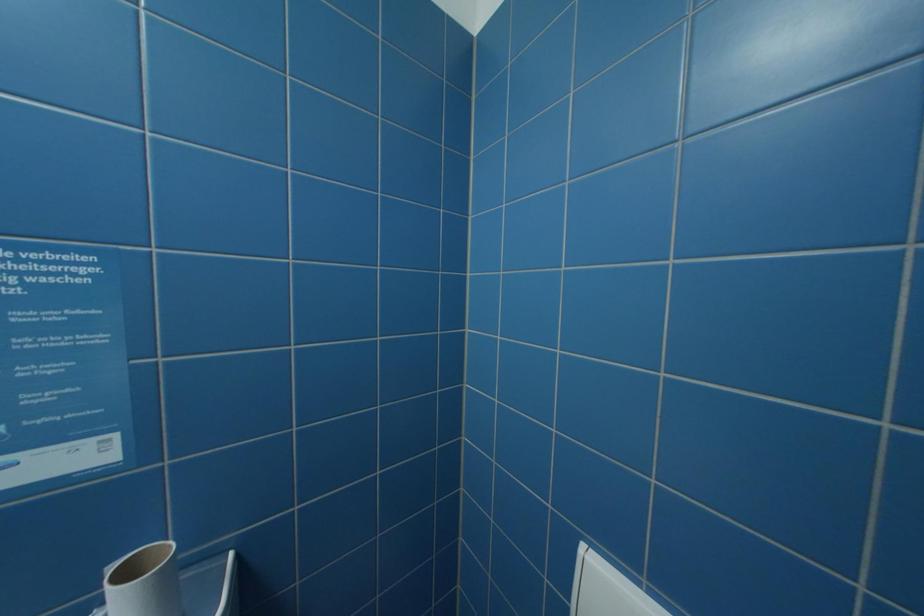
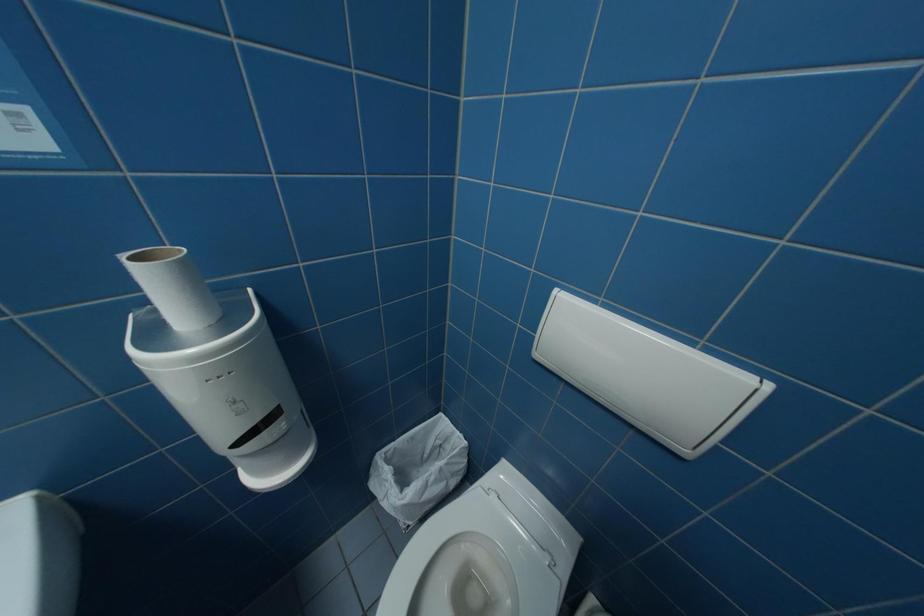
In a continuous first-person perspective shot, in which direction is the camera moving?

The movement direction of the cameraman is left, backward.